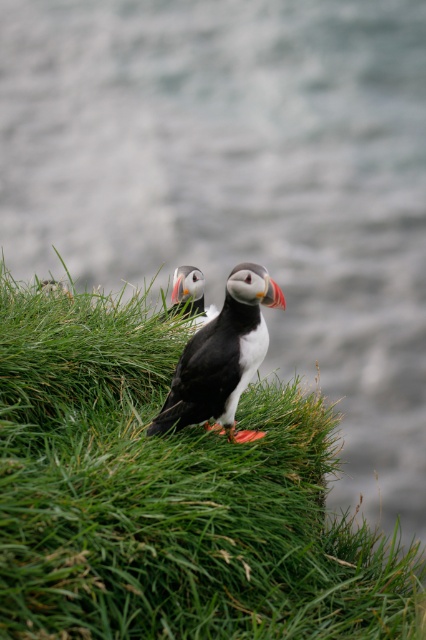
Which of these two, black matte puffin at center or orange beak puffin at center, stands taller?

black matte puffin at center is taller.

In the scene shown: Does black matte puffin at center have a larger size compared to orange beak puffin at center?

Yes.

Measure the distance between black matte puffin at center and camera.

black matte puffin at center and camera are 4.30 meters apart from each other.

At what (x,y) coordinates should I click in order to perform the action: click on black matte puffin at center. Please return your answer as a coordinate pair (x, y). The image size is (426, 640). Looking at the image, I should click on (221, 356).

Is green grassy at center smaller than black matte puffin at center?

Incorrect, green grassy at center is not smaller in size than black matte puffin at center.

Is green grassy at center taller than black matte puffin at center?

Yes, green grassy at center is taller than black matte puffin at center.

This screenshot has height=640, width=426. In order to click on green grassy at center in this screenshot , I will do `click(170, 496)`.

Between point (233, 588) and point (183, 289), which one is positioned behind?

The point (183, 289) is behind.

Between point (414, 579) and point (198, 324), which one is positioned in front?

Positioned in front is point (414, 579).

Is point (161, 342) closer to camera compared to point (176, 300)?

Yes, point (161, 342) is in front of point (176, 300).

Where is `green grassy at center`? The width and height of the screenshot is (426, 640). green grassy at center is located at coordinates (170, 496).